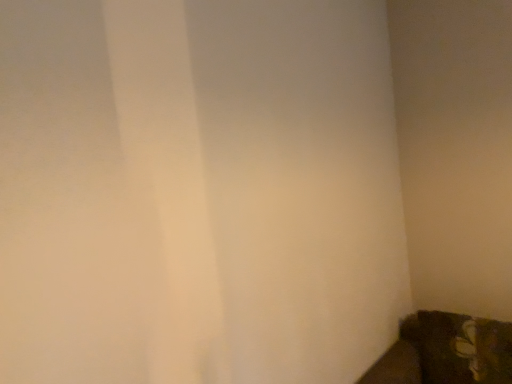
Question: Should I look upward or downward to see brown fuzzy couch at lower right?

Choices:
 (A) down
 (B) up

Answer: (A)